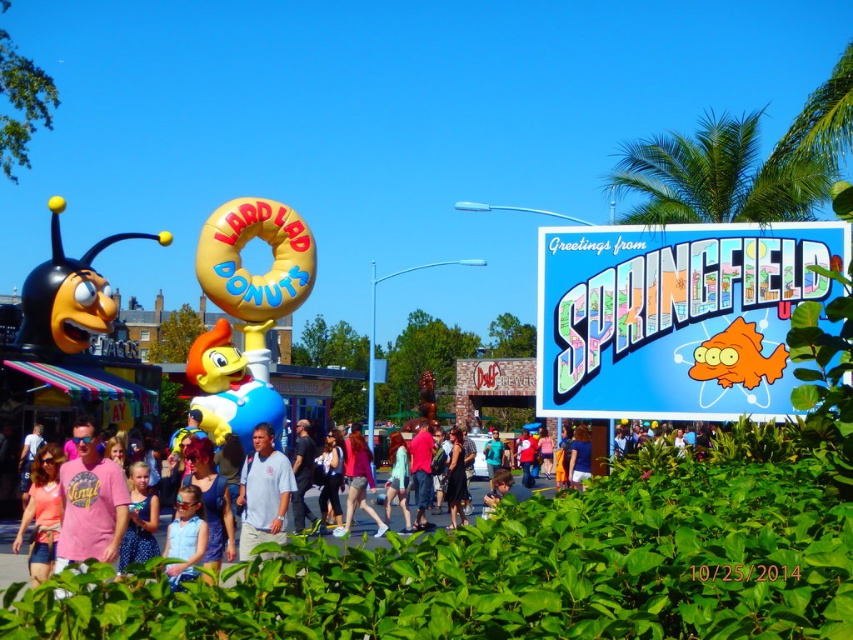
You are a photographer trying to capture a photo of the blue fabric shirt at center without the green leafy palm tree at upper right blocking it. Is there a way to adjust your position so that the palm tree isn not in the frame?

The green leafy palm tree at upper right might be wider than the blue fabric shirt at center, so adjusting your position might not be possible without moving further away or changing the angle to ensure the palm tree is out of the frame.

You are a drone operator tasked with capturing aerial footage of the theme park attraction. Your drone has a maximum flight range of 80 meters. If you are currently positioned at the green leafy palm tree at upper right, can you fly your drone to the blue fabric shirt at center without exceeding its range?

The green leafy palm tree at upper right and blue fabric shirt at center are 77.94 meters apart from each other. Since the drone has a maximum flight range of 80 meters, the distance between them is within the drone operator can safely fly the drone from the green leafy palm tree at upper right to the blue fabric shirt at center without exceeding the range.